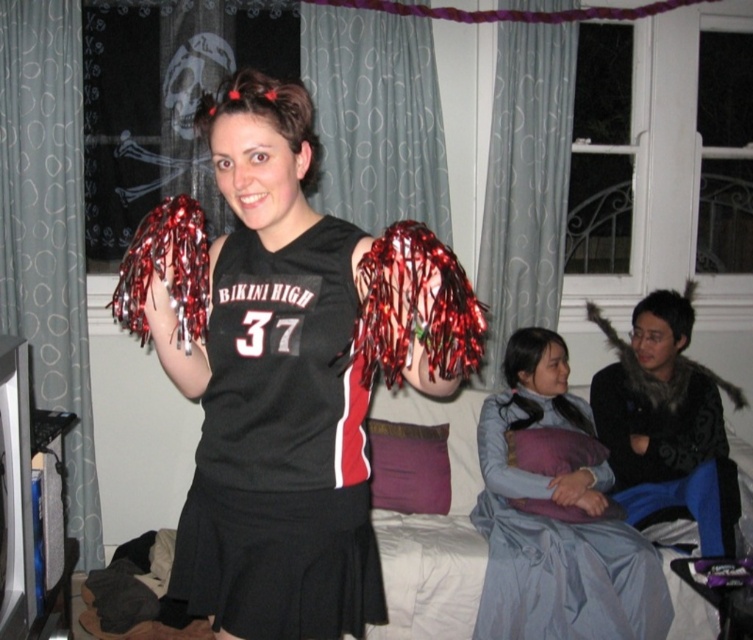
Is point (267, 612) in front of point (601, 618)?

Yes, it is in front of point (601, 618).

Between point (235, 234) and point (511, 561), which one is positioned behind?

The point (511, 561) is more distant.

Locate an element on the screen. Image resolution: width=753 pixels, height=640 pixels. matte black cheerleader outfit at center is located at coordinates (294, 378).

Who is higher up, matte black cheerleader outfit at center or black jersey at center?

Positioned higher is matte black cheerleader outfit at center.

Find the location of a particular element. matte black cheerleader outfit at center is located at coordinates (294, 378).

Where is `matte black cheerleader outfit at center`? matte black cheerleader outfit at center is located at coordinates (294, 378).

Can you confirm if black jersey at center is positioned below light blue satin dress at lower right?

Incorrect, black jersey at center is not positioned below light blue satin dress at lower right.

Can you confirm if black jersey at center is shorter than light blue satin dress at lower right?

Indeed, black jersey at center has a lesser height compared to light blue satin dress at lower right.

The width and height of the screenshot is (753, 640). What do you see at coordinates (282, 449) in the screenshot? I see `black jersey at center` at bounding box center [282, 449].

Identify the location of black jersey at center. The image size is (753, 640). (282, 449).